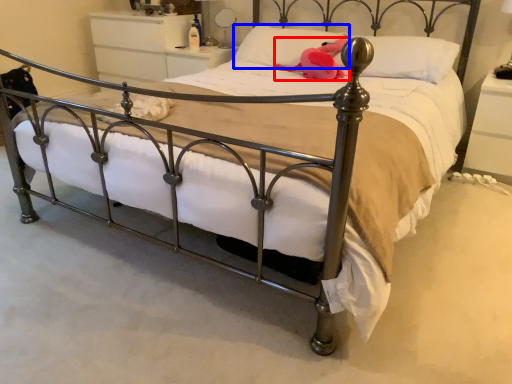
Question: Among these objects, which one is nearest to the camera, animal (highlighted by a red box) or pillow (highlighted by a blue box)?

Choices:
 (A) animal
 (B) pillow

Answer: (A)